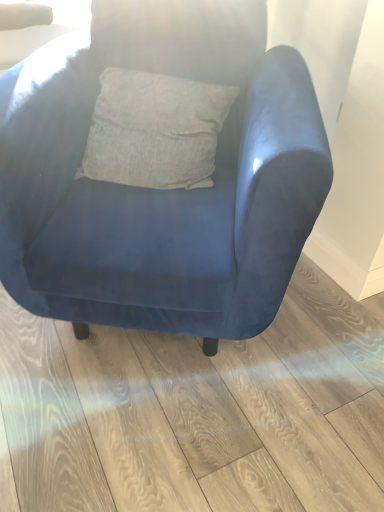
The image size is (384, 512). Identify the location of free space above blue velvet armchair at center (from a real-world perspective). (218, 390).